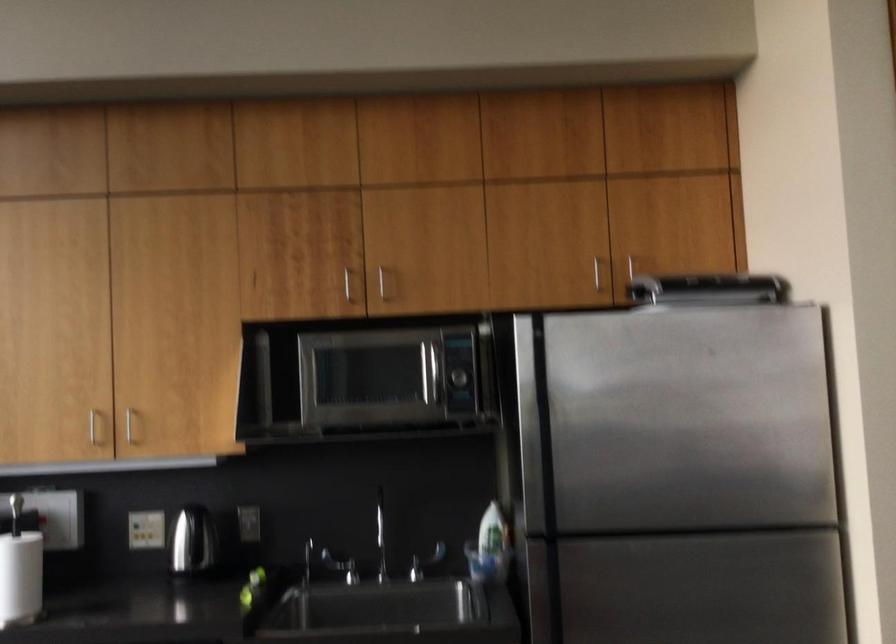
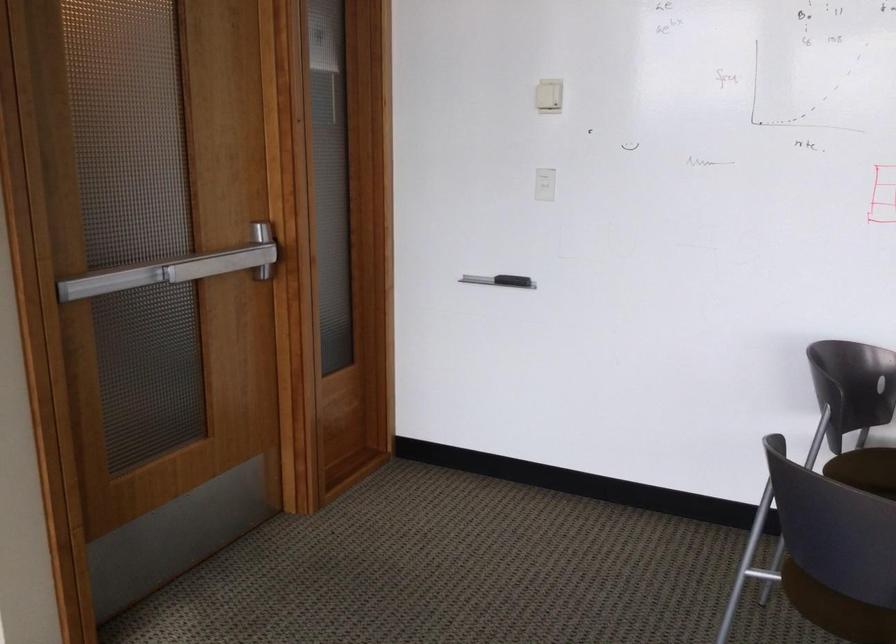
Question: The camera is either moving clockwise (left) or counter-clockwise (right) around the object. The first image is from the beginning of the video and the second image is from the end. Is the camera moving left or right when shooting the video?

Choices:
 (A) Left
 (B) Right

Answer: (A)